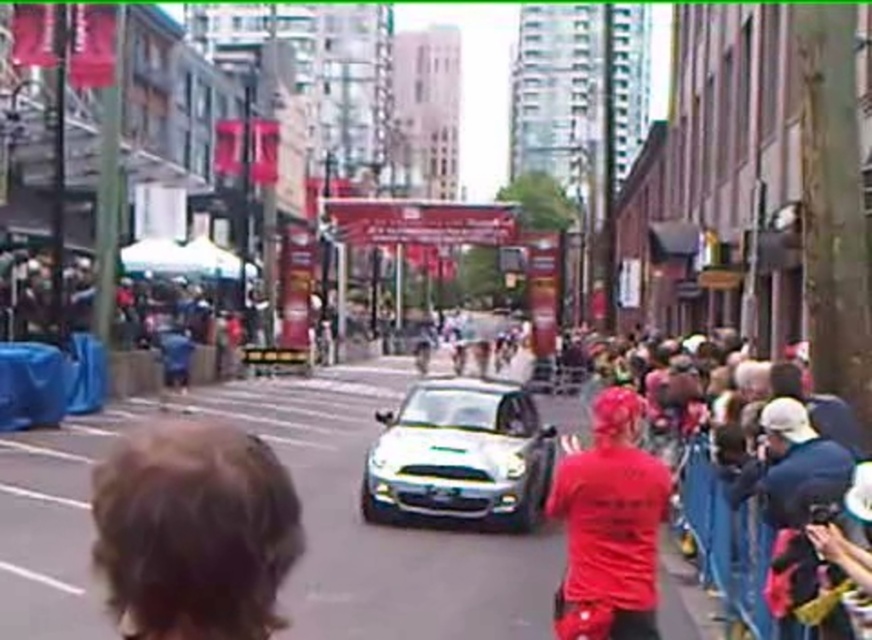
Can you confirm if brown curly hair at lower left is positioned to the left of red matte shirt at center?

Indeed, brown curly hair at lower left is positioned on the left side of red matte shirt at center.

Is point (153, 467) farther from viewer compared to point (586, 566)?

No, (153, 467) is closer to viewer.

Image resolution: width=872 pixels, height=640 pixels. I want to click on brown curly hair at lower left, so click(x=193, y=531).

Can you confirm if white metallic sports car at center is taller than red matte shirt at center?

Yes.

Can you confirm if white metallic sports car at center is wider than red matte shirt at center?

Yes.

The height and width of the screenshot is (640, 872). What are the coordinates of `white metallic sports car at center` in the screenshot? It's located at (460, 454).

Is red fabric crowd at right above red matte shirt at center?

Actually, red fabric crowd at right is below red matte shirt at center.

Between point (601, 500) and point (620, 552), which one is positioned in front?

Positioned in front is point (620, 552).

Is point (634, 464) positioned behind point (634, 438)?

No.

At what (x,y) coordinates should I click in order to perform the action: click on red fabric crowd at right. Please return your answer as a coordinate pair (x, y). The height and width of the screenshot is (640, 872). Looking at the image, I should click on (608, 518).